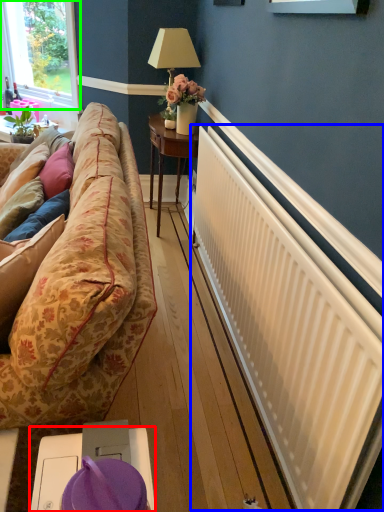
Question: Which object is the farthest from table (highlighted by a red box)? Choose among these: radiator (highlighted by a blue box) or window (highlighted by a green box).

Choices:
 (A) radiator
 (B) window

Answer: (B)